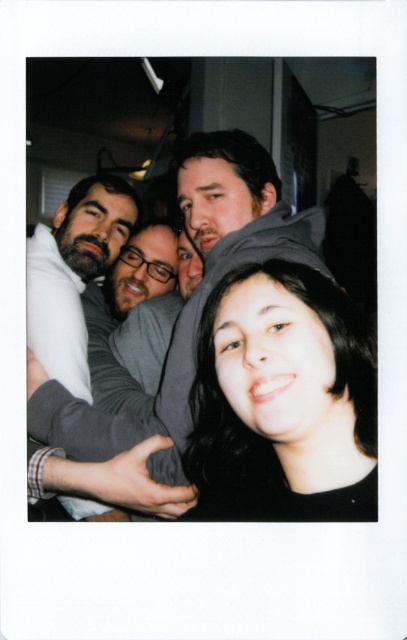
You are organizing a clothing donation drive and need to sort items by size. You have two garments in front of you, the gray hoodie at center and the dark gray sweater at left. Which one should you place in the large size bin?

The gray hoodie at center should be placed in the large size bin because it has a larger size compared to the dark gray sweater at left.

In the Polaroid photo, there are four people. The woman in the foreground is wearing a black top and has dark hair. Behind her are three men. There is a specific point at coordinates [282,401]. What is located at that point?

The point at [282,401] marks the black matte hair at center.

You are at a party and want to take a photo of the black matte hair at center and the gray hoodie at center. Which one is closer to the camera?

The black matte hair at center is closer to the viewer than the gray hoodie at center.